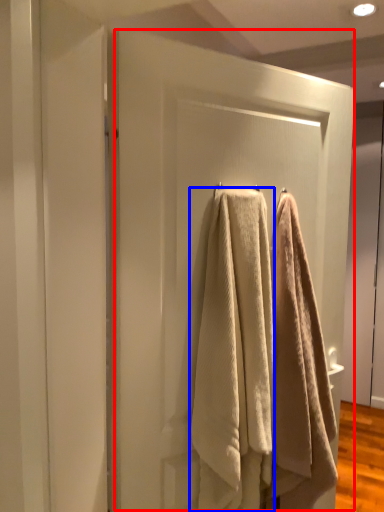
Question: Which point is further to the camera, screen door (highlighted by a red box) or towel (highlighted by a blue box)?

Choices:
 (A) screen door
 (B) towel

Answer: (B)